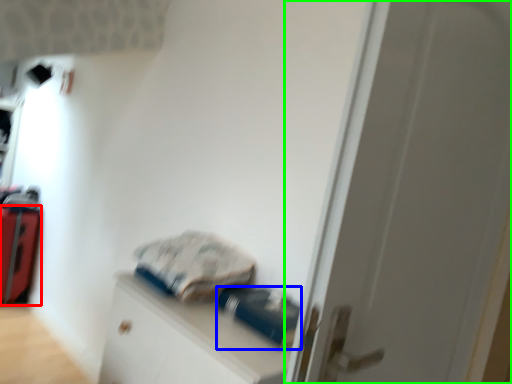
Question: Estimate the real-world distances between objects in this image. Which object is farther from luggage (highlighted by a red box), equipment (highlighted by a blue box) or door (highlighted by a green box)?

Choices:
 (A) equipment
 (B) door

Answer: (B)